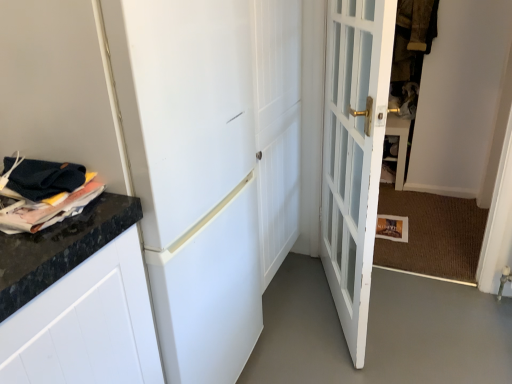
Where is `free space to the left of white glass door at center, acting as the 1th door starting from the right`? free space to the left of white glass door at center, acting as the 1th door starting from the right is located at coordinates (302, 313).